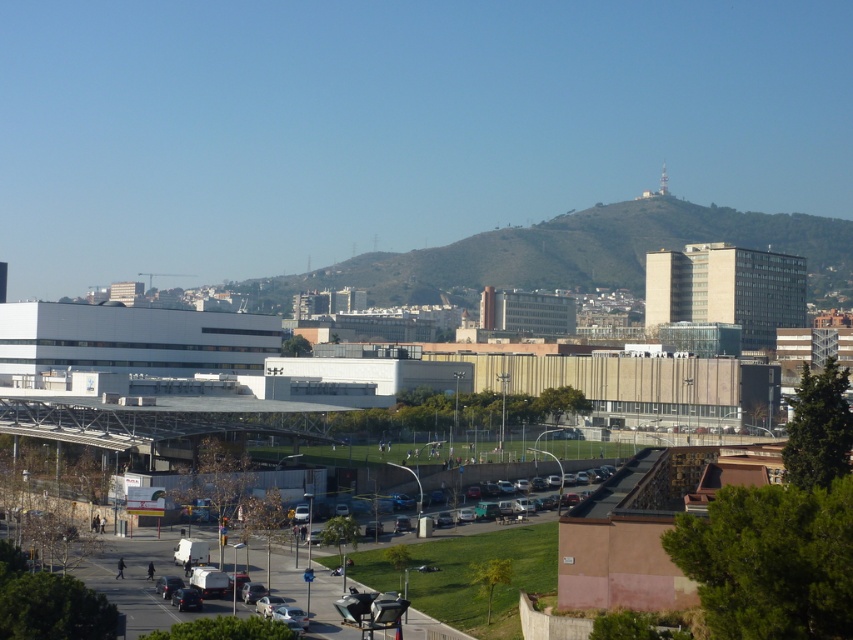
Can you confirm if silver metallic car at lower center is thinner than metallic silver van at lower center?

In fact, silver metallic car at lower center might be wider than metallic silver van at lower center.

Can you confirm if silver metallic car at lower center is taller than metallic silver van at lower center?

No.

Describe the element at coordinates (289, 616) in the screenshot. I see `silver metallic car at lower center` at that location.

What are the coordinates of `silver metallic car at lower center` in the screenshot? It's located at (289, 616).